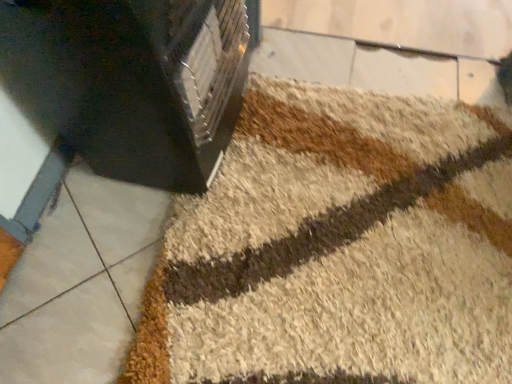
Question: Does point (388, 160) appear closer or farther from the camera than point (53, 79)?

Choices:
 (A) farther
 (B) closer

Answer: (A)

Question: From the image's perspective, is beige shaggy bath mat at center positioned above or below black plastic heater at upper left?

Choices:
 (A) below
 (B) above

Answer: (A)

Question: From their relative heights in the image, would you say beige shaggy bath mat at center is taller or shorter than black plastic heater at upper left?

Choices:
 (A) short
 (B) tall

Answer: (A)

Question: From a real-world perspective, is black plastic heater at upper left positioned above or below beige shaggy bath mat at center?

Choices:
 (A) above
 (B) below

Answer: (A)

Question: In the image, is black plastic heater at upper left positioned in front of or behind beige shaggy bath mat at center?

Choices:
 (A) front
 (B) behind

Answer: (A)

Question: Considering the positions of point (194, 66) and point (155, 380), is point (194, 66) closer or farther from the camera than point (155, 380)?

Choices:
 (A) farther
 (B) closer

Answer: (B)

Question: Considering the positions of black plastic heater at upper left and beige shaggy bath mat at center in the image, is black plastic heater at upper left bigger or smaller than beige shaggy bath mat at center?

Choices:
 (A) big
 (B) small

Answer: (A)